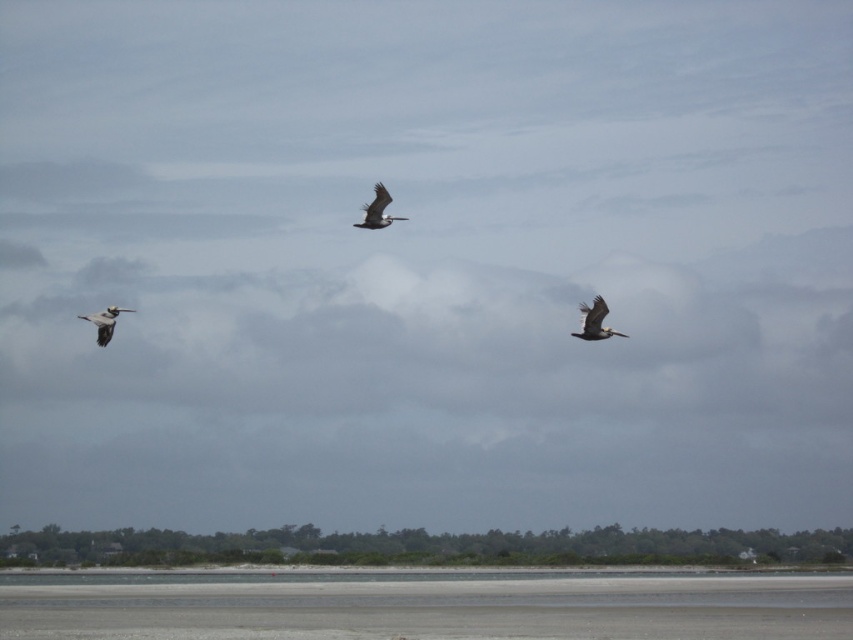
Between brown feathered pelican at center and gray feathered pelican at left, which one appears on the right side from the viewer's perspective?

From the viewer's perspective, brown feathered pelican at center appears more on the right side.

Is brown feathered pelican at center to the right of gray feathered pelican at left from the viewer's perspective?

Indeed, brown feathered pelican at center is positioned on the right side of gray feathered pelican at left.

Describe the element at coordinates (376, 209) in the screenshot. I see `brown feathered pelican at center` at that location.

Image resolution: width=853 pixels, height=640 pixels. Identify the location of brown feathered pelican at center. (376, 209).

Does brown feathered pelican at right appear on the right side of gray feathered pelican at left?

Indeed, brown feathered pelican at right is positioned on the right side of gray feathered pelican at left.

Which is behind, point (618, 333) or point (100, 321)?

The point (618, 333) is behind.

Which is in front, point (596, 304) or point (102, 323)?

Point (102, 323) is more forward.

The width and height of the screenshot is (853, 640). In order to click on brown feathered pelican at right in this screenshot , I will do `click(595, 321)`.

Is brown feathered pelican at right wider than brown feathered pelican at center?

No.

Which is below, brown feathered pelican at right or brown feathered pelican at center?

brown feathered pelican at right

Which is in front, point (593, 324) or point (381, 189)?

Point (593, 324) is more forward.

Identify the location of brown feathered pelican at right. (595, 321).